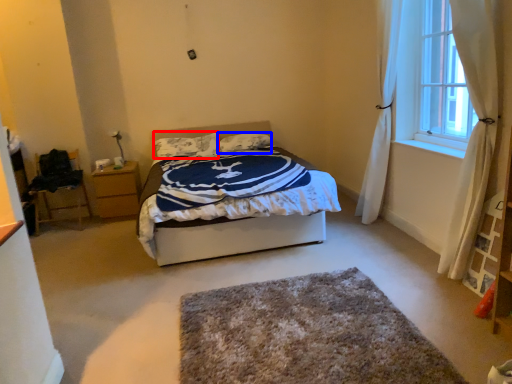
Question: Among these objects, which one is farthest to the camera, pillow (highlighted by a red box) or pillow (highlighted by a blue box)?

Choices:
 (A) pillow
 (B) pillow

Answer: (B)